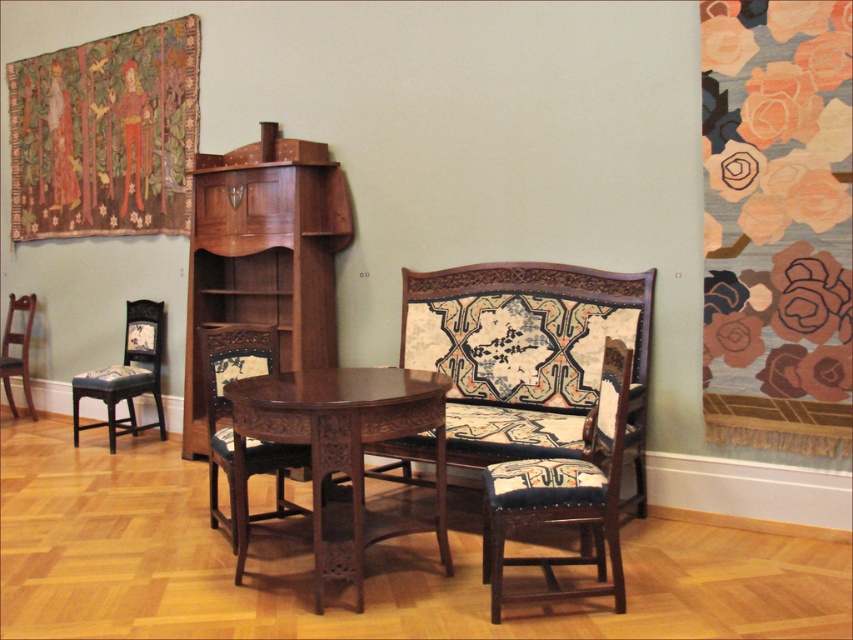
You are arranging a small party in this vintage room and need to place a tall centerpiece on the table. The dark blue fabric armchair at center is already positioned. Can the richly colored fabric tapestry at upper left, which is taller than the armchair, be placed behind the chair without blocking the view from the table?

The richly colored fabric tapestry at upper left is taller than the dark blue fabric armchair at center, so placing it behind the chair might block the view from the table since it is taller.

You are standing in the room and want to move from the entrance to the mahogany wood table at center. There is a matte dark wood armchair at left in your path. Can you walk around the armchair without moving the table?

The mahogany wood table at center is closer to the viewer than the matte dark wood armchair at left, so you can walk around the armchair since it is further away from you and the table is nearer, allowing space to navigate around the chair.

You are planning to rearrange the furniture in this vintage room. If you want to place a large rectangular rug under the mahogany wood table at center and the matte dark wood armchair at left, which object should be placed closer to the edge of the rug to ensure the rug is large enough to accommodate both?

The matte dark wood armchair at left should be placed closer to the edge of the rug because the mahogany wood table at center is larger and requires more space, so positioning the smaller armchair near the edge ensures the rug can cover both objects adequately.